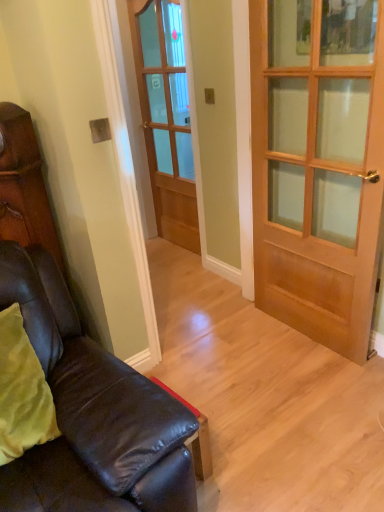
You are a GUI agent. You are given a task and a screenshot of the screen. Output one action in this format:
    pyautogui.click(x=<x>, y=<y>)
    Task: Click on the vacant space to the left of wooden door at center, arranged as the second door when viewed from the back
    The width and height of the screenshot is (384, 512).
    Given the screenshot: What is the action you would take?
    click(x=236, y=346)